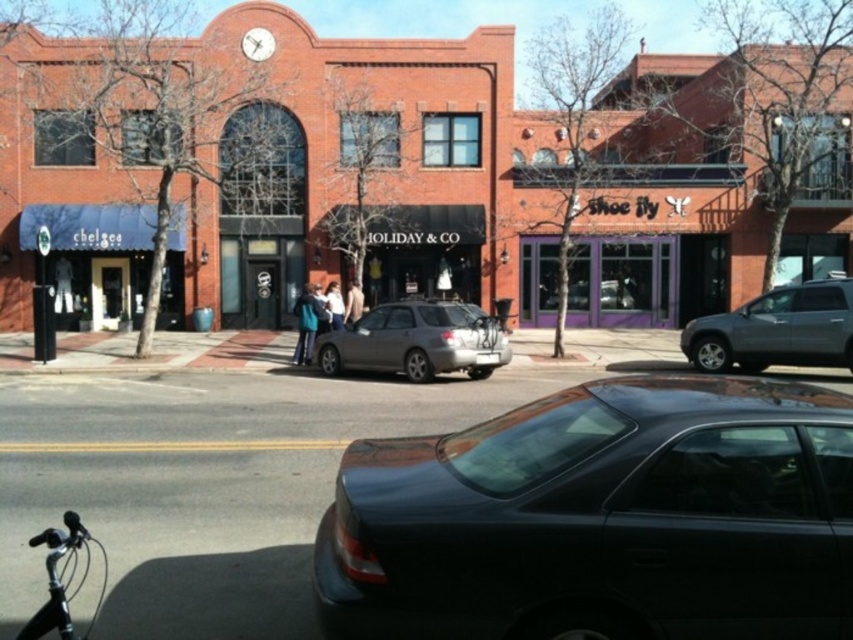
You are a delivery person needing to park your vehicle in this street scene. You have a shiny black sedan at center and a satin silver sedan at center in front of you. Which sedan should you move to access the parking spot closer to the Holiday and Co. building?

The shiny black sedan at center is closer to the viewer than the satin silver sedan at center, so you should move the shiny black sedan at center to access the parking spot closer to the Holiday and Co. building.

You are a delivery person who needs to park your delivery van next to the silver metallic suv at right. However, there is a shiny silver handlebars at lower left in the way. Can you park your van there without moving the handlebars?

The silver metallic suv at right is smaller than the shiny silver handlebars at lower left. Since the handlebars are larger, they might block the parking space. Therefore, you cannot park your van there without moving the handlebars.